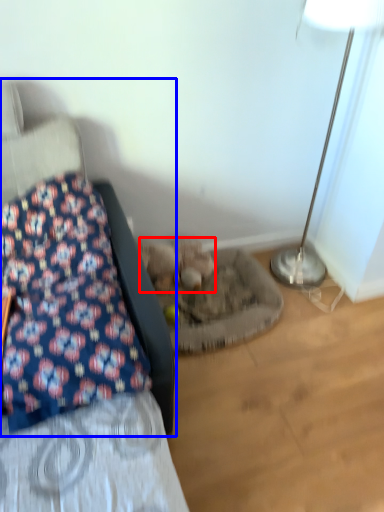
Question: Which object is further to the camera taking this photo, animal (highlighted by a red box) or furniture (highlighted by a blue box)?

Choices:
 (A) animal
 (B) furniture

Answer: (A)